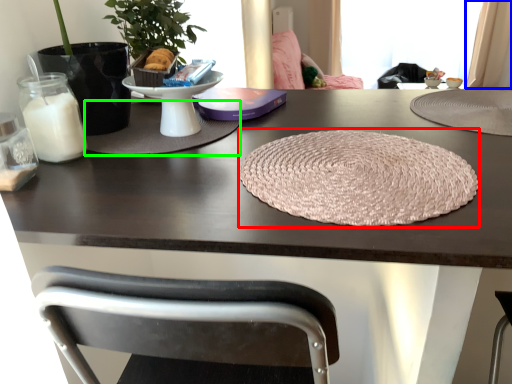
Question: Which object is the closest to the yoga mat (highlighted by a red box)? Choose among these: curtain (highlighted by a blue box) or mat (highlighted by a green box).

Choices:
 (A) curtain
 (B) mat

Answer: (B)